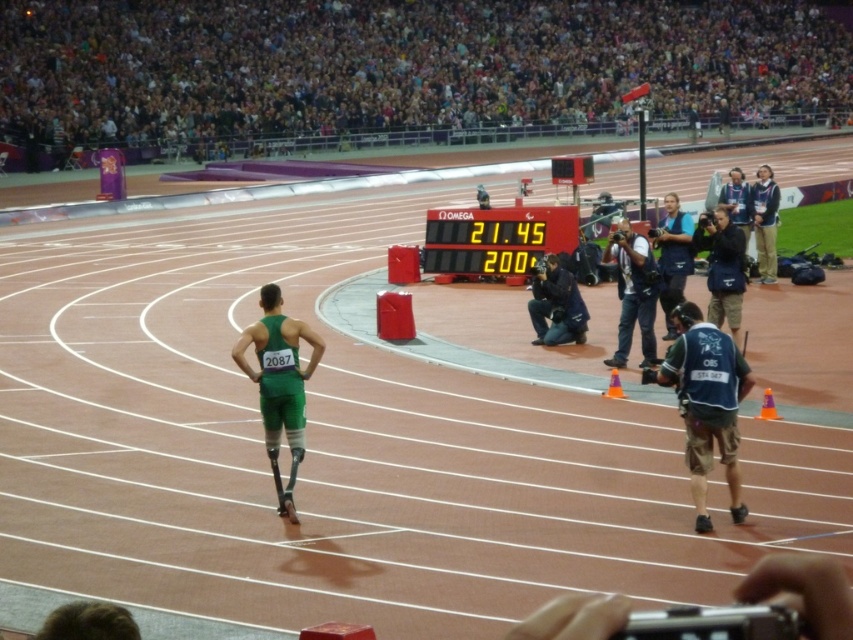
Looking at this image, can you confirm if dark blue uniform at center is positioned to the left of dark blue jacket at upper right?

Correct, you'll find dark blue uniform at center to the left of dark blue jacket at upper right.

Between point (532, 296) and point (759, 244), which one is positioned behind?

Positioned behind is point (759, 244).

Locate an element on the screen. dark blue uniform at center is located at coordinates (556, 305).

Is dark blue shirt at right to the right of dark blue jacket at upper right from the viewer's perspective?

Incorrect, dark blue shirt at right is not on the right side of dark blue jacket at upper right.

Who is shorter, dark blue shirt at right or dark blue jacket at upper right?

dark blue shirt at right

Between point (630, 321) and point (766, 252), which one is positioned behind?

Positioned behind is point (766, 252).

Locate an element on the screen. This screenshot has height=640, width=853. dark blue shirt at right is located at coordinates (633, 292).

Image resolution: width=853 pixels, height=640 pixels. Describe the element at coordinates (556, 305) in the screenshot. I see `dark blue uniform at center` at that location.

Who is lower down, dark blue uniform at center or dark blue uniform at upper right?

dark blue uniform at center is lower down.

Who is more distant from viewer, (x=556, y=321) or (x=717, y=202)?

Positioned behind is point (x=717, y=202).

At what (x,y) coordinates should I click in order to perform the action: click on dark blue uniform at center. Please return your answer as a coordinate pair (x, y). The width and height of the screenshot is (853, 640). Looking at the image, I should click on (556, 305).